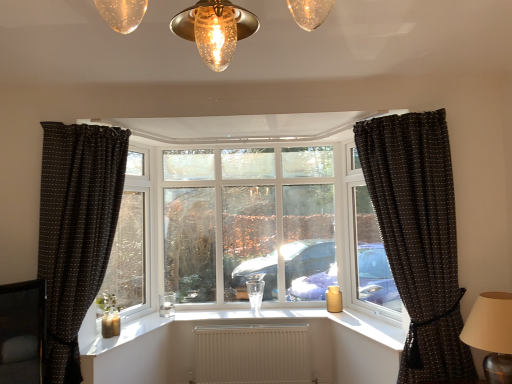
Question: Can you confirm if clear glass window at right, the first window frame from the right, is bigger than white textured radiator at center?

Choices:
 (A) yes
 (B) no

Answer: (A)

Question: Can you confirm if clear glass window at right, the first window frame from the right, is positioned to the left of white textured radiator at center?

Choices:
 (A) no
 (B) yes

Answer: (A)

Question: Is white textured radiator at center completely or partially inside clear glass window at right, the 2th window frame in the left-to-right sequence?

Choices:
 (A) yes
 (B) no

Answer: (B)

Question: From a real-world perspective, is clear glass window at right, the 2th window frame in the left-to-right sequence, under white textured radiator at center?

Choices:
 (A) no
 (B) yes

Answer: (A)

Question: Is clear glass window at right, the 2th window frame in the left-to-right sequence, in front of white textured radiator at center?

Choices:
 (A) yes
 (B) no

Answer: (A)

Question: From the image's perspective, relative to black dotted fabric curtain at right, which appears as the first curtain when viewed from the right, is white textured radiator at center above or below?

Choices:
 (A) below
 (B) above

Answer: (A)

Question: In terms of width, does white textured radiator at center look wider or thinner when compared to black dotted fabric curtain at right, the 2th curtain positioned from the left?

Choices:
 (A) wide
 (B) thin

Answer: (B)

Question: From their relative heights in the image, would you say white textured radiator at center is taller or shorter than black dotted fabric curtain at right, which appears as the first curtain when viewed from the right?

Choices:
 (A) tall
 (B) short

Answer: (B)

Question: Would you say white textured radiator at center is to the left or to the right of black dotted fabric curtain at right, the 2th curtain positioned from the left, in the picture?

Choices:
 (A) left
 (B) right

Answer: (A)

Question: Visually, is black dotted fabric curtain at right, which appears as the first curtain when viewed from the right, positioned to the left or to the right of clear glass window at left, which ranks as the first window frame in left-to-right order?

Choices:
 (A) left
 (B) right

Answer: (B)

Question: From the image's perspective, is black dotted fabric curtain at right, the 2th curtain positioned from the left, above or below clear glass window at left, which ranks as the first window frame in left-to-right order?

Choices:
 (A) below
 (B) above

Answer: (A)

Question: Considering the positions of black dotted fabric curtain at right, which appears as the first curtain when viewed from the right, and clear glass window at left, which ranks as the first window frame in left-to-right order, in the image, is black dotted fabric curtain at right, which appears as the first curtain when viewed from the right, wider or thinner than clear glass window at left, which ranks as the first window frame in left-to-right order,?

Choices:
 (A) wide
 (B) thin

Answer: (A)

Question: In terms of size, does black dotted fabric curtain at right, which appears as the first curtain when viewed from the right, appear bigger or smaller than clear glass window at left, which ranks as the first window frame in left-to-right order?

Choices:
 (A) big
 (B) small

Answer: (A)

Question: Is clear glass window at right, the first window frame from the right, bigger or smaller than clear glass window at left, arranged as the 2th window frame when viewed from the right?

Choices:
 (A) small
 (B) big

Answer: (B)

Question: From the image's perspective, relative to clear glass window at left, which ranks as the first window frame in left-to-right order, is clear glass window at right, the 2th window frame in the left-to-right sequence, above or below?

Choices:
 (A) below
 (B) above

Answer: (B)